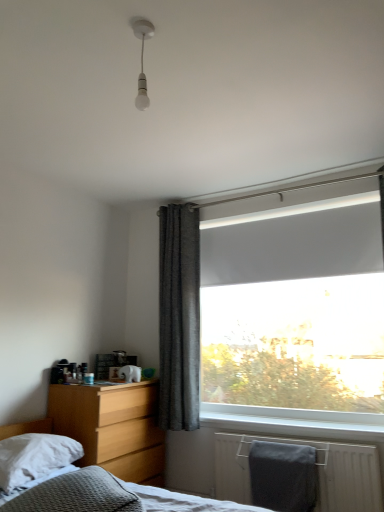
I want to click on white soft pillow at lower left, so click(34, 458).

Looking at this image, in order to face white soft pillow at lower left, should I rotate leftwards or rightwards?

To align with it, rotate left about 20.822°.

Locate an element on the screen. Image resolution: width=384 pixels, height=512 pixels. textured gray bed at lower left is located at coordinates (185, 501).

The height and width of the screenshot is (512, 384). What do you see at coordinates (185, 501) in the screenshot?
I see `textured gray bed at lower left` at bounding box center [185, 501].

The height and width of the screenshot is (512, 384). What are the coordinates of `white matte window screen at upper right` in the screenshot? It's located at (294, 242).

Between white matte window screen at upper right and dark grey textured curtain at center, which one is positioned in front?

white matte window screen at upper right is more forward.

Considering the relative sizes of white matte window screen at upper right and dark grey textured curtain at center in the image provided, is white matte window screen at upper right thinner than dark grey textured curtain at center?

Correct, the width of white matte window screen at upper right is less than that of dark grey textured curtain at center.

Would you say white matte window screen at upper right is to the left or to the right of dark grey textured curtain at center in the picture?

In the image, white matte window screen at upper right appears on the right side of dark grey textured curtain at center.

From the image's perspective, who appears lower, white soft pillow at lower left or light wood/finish nightstand at lower left?

light wood/finish nightstand at lower left, from the image's perspective.

From a real-world perspective, which object stands above the other?

white soft pillow at lower left, from a real-world perspective.

In the scene shown: Can you confirm if white soft pillow at lower left is positioned to the left of light wood/finish nightstand at lower left?

Correct, you'll find white soft pillow at lower left to the left of light wood/finish nightstand at lower left.

Which of these two, white soft pillow at lower left or light wood/finish nightstand at lower left, is wider?

light wood/finish nightstand at lower left.

From the image's perspective, does white glossy bulb at upper center appear lower than textured gray bed at lower left?

No.

Is white glossy bulb at upper center situated inside textured gray bed at lower left or outside?

white glossy bulb at upper center is located beyond the bounds of textured gray bed at lower left.

Is white glossy bulb at upper center facing towards textured gray bed at lower left?

No.

Is point (102, 467) positioned before point (173, 423)?

Yes, it is in front of point (173, 423).

Looking at this image, is light wood/finish nightstand at lower left thinner than dark grey textured curtain at center?

No.

Can you confirm if light wood/finish nightstand at lower left is positioned to the left of dark grey textured curtain at center?

Yes.

Could you tell me if light wood/finish nightstand at lower left is turned towards dark grey textured curtain at center?

No, light wood/finish nightstand at lower left is not aimed at dark grey textured curtain at center.

Between white soft pillow at lower left and white matte window screen at upper right, which one is positioned in front?

white soft pillow at lower left is in front.

Could you tell me if white soft pillow at lower left is turned towards white matte window screen at upper right?

No, white soft pillow at lower left is not turned towards white matte window screen at upper right.

From the image's perspective, which is below, white soft pillow at lower left or white matte window screen at upper right?

white soft pillow at lower left.

Is light wood/finish nightstand at lower left located within white glossy bulb at upper center?

Actually, light wood/finish nightstand at lower left is outside white glossy bulb at upper center.

Locate an element on the screen. Image resolution: width=384 pixels, height=512 pixels. light fixture lying in front of the light wood/finish nightstand at lower left is located at coordinates (142, 59).

Would you consider white glossy bulb at upper center to be distant from light wood/finish nightstand at lower left?

Yes, white glossy bulb at upper center is far from light wood/finish nightstand at lower left.

From the image's perspective, is white glossy bulb at upper center beneath light wood/finish nightstand at lower left?

Incorrect, from the image's perspective, white glossy bulb at upper center is higher than light wood/finish nightstand at lower left.

Which of these two, light wood/finish nightstand at lower left or white matte window screen at upper right, is wider?

Wider between the two is light wood/finish nightstand at lower left.

Which is in front, point (85, 410) or point (266, 271)?

The point (85, 410) is in front.

Measure the distance from light wood/finish nightstand at lower left to white matte window screen at upper right.

light wood/finish nightstand at lower left is 1.51 meters away from white matte window screen at upper right.

Are light wood/finish nightstand at lower left and white matte window screen at upper right making contact?

No, light wood/finish nightstand at lower left is not touching white matte window screen at upper right.

Image resolution: width=384 pixels, height=512 pixels. What are the coordinates of `window screen in front of the dark grey textured curtain at center` in the screenshot? It's located at (294, 242).

Locate an element on the screen. The width and height of the screenshot is (384, 512). nightstand located behind the white soft pillow at lower left is located at coordinates (112, 428).

Based on their spatial positions, is textured gray bed at lower left or light wood/finish nightstand at lower left further from white glossy bulb at upper center?

Based on the image, light wood/finish nightstand at lower left appears to be further to white glossy bulb at upper center.

From the image, which object appears to be nearer to white matte window screen at upper right, textured gray bed at lower left or white soft pillow at lower left?

The object closer to white matte window screen at upper right is textured gray bed at lower left.

Estimate the real-world distances between objects in this image. Which object is further from dark grey textured curtain at center, white matte window screen at upper right or white glossy bulb at upper center?

The object further to dark grey textured curtain at center is white glossy bulb at upper center.

Based on their spatial positions, is gray matte towel at lower right or white matte window screen at upper right further from light wood/finish nightstand at lower left?

The object further to light wood/finish nightstand at lower left is white matte window screen at upper right.

Considering their positions, is white soft pillow at lower left positioned further to dark grey textured curtain at center than gray matte towel at lower right?

white soft pillow at lower left.

Which object lies nearer to the anchor point white glossy bulb at upper center, dark grey textured curtain at center or textured gray bed at lower left?

dark grey textured curtain at center.

Considering their positions, is white soft pillow at lower left positioned closer to white glossy bulb at upper center than textured gray bed at lower left?

Based on the image, white soft pillow at lower left appears to be nearer to white glossy bulb at upper center.

Considering their positions, is white matte window screen at upper right positioned closer to white glossy bulb at upper center than textured gray bed at lower left?

Among the two, white matte window screen at upper right is located nearer to white glossy bulb at upper center.

This screenshot has width=384, height=512. Find the location of `pillow between white glossy bulb at upper center and gray matte towel at lower right in the up-down direction`. pillow between white glossy bulb at upper center and gray matte towel at lower right in the up-down direction is located at coordinates (34, 458).

Locate an element on the screen. The height and width of the screenshot is (512, 384). pillow between white glossy bulb at upper center and textured gray bed at lower left vertically is located at coordinates (34, 458).

This screenshot has width=384, height=512. What are the coordinates of `radiator between white matte window screen at upper right and light wood/finish nightstand at lower left from top to bottom` in the screenshot? It's located at (318, 472).

This screenshot has width=384, height=512. In order to click on radiator between white soft pillow at lower left and white matte window screen at upper right in this screenshot , I will do `click(318, 472)`.